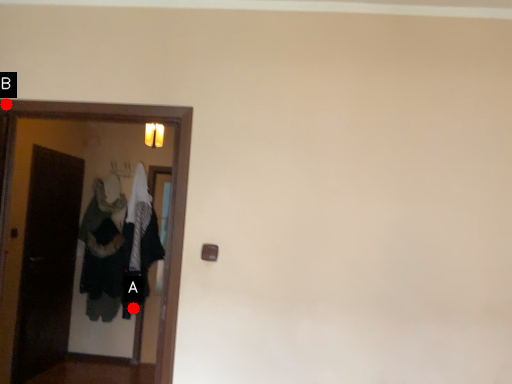
Question: Two points are circled on the image, labeled by A and B beside each circle. Which point appears closest to the camera in this image?

Choices:
 (A) A is closer
 (B) B is closer

Answer: (B)